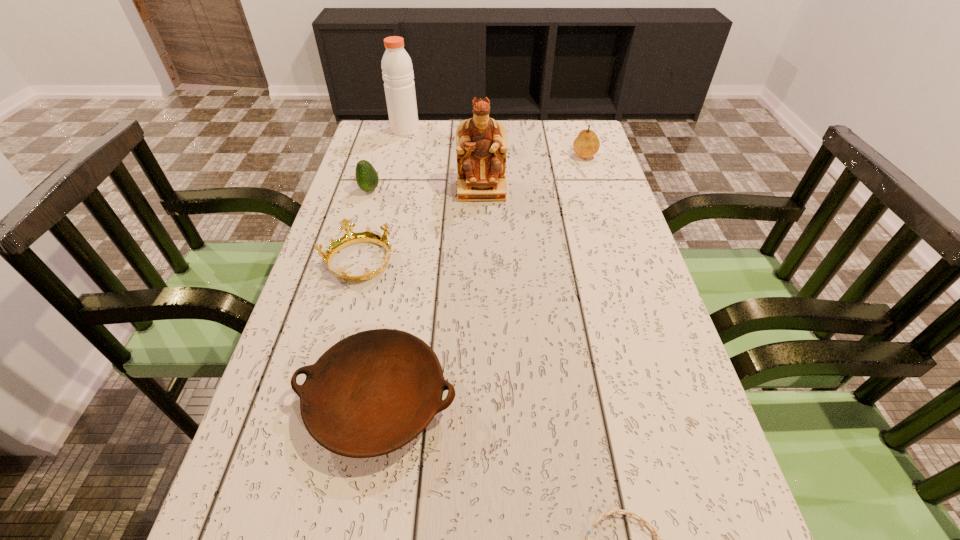
Identify the location of shaker. This screenshot has height=540, width=960. (397, 69).

Where is `figurine`? The width and height of the screenshot is (960, 540). figurine is located at coordinates (481, 142).

Locate an element on the screen. Image resolution: width=960 pixels, height=540 pixels. the second farthest object is located at coordinates (586, 145).

Where is `pear`? This screenshot has height=540, width=960. pear is located at coordinates (586, 145).

This screenshot has height=540, width=960. I want to click on avocado, so click(366, 176).

You are a GUI agent. You are given a task and a screenshot of the screen. Output one action in this format:
    pyautogui.click(x=<x>, y=<y>)
    Task: Click on the third nearest object
    This screenshot has width=960, height=540.
    Given the screenshot: What is the action you would take?
    pyautogui.click(x=349, y=238)

Where is `plate`? plate is located at coordinates (373, 392).

Locate an element on the screen. free location located 0.110m on the front of the farthest object is located at coordinates (399, 154).

I want to click on vacant space situated 0.180m on the front-facing side of the figurine, so click(x=482, y=245).

Find the location of `vacant space located on the back of the pear`. vacant space located on the back of the pear is located at coordinates (577, 132).